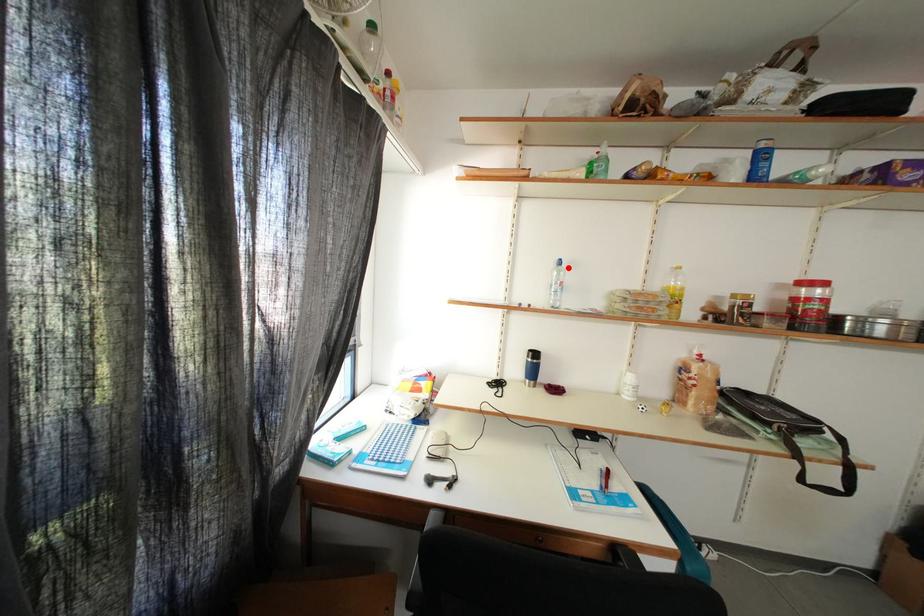
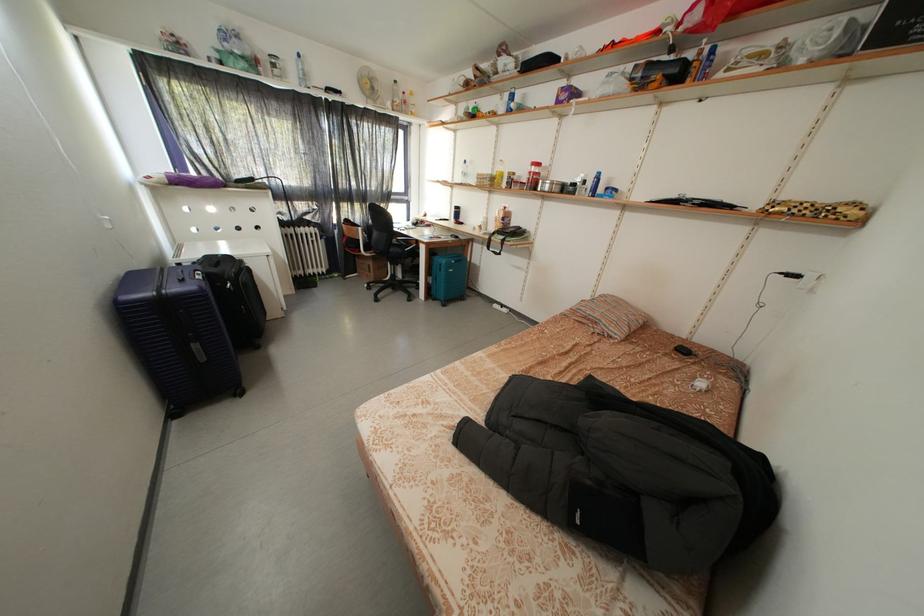
Find the pixel in the second image that matches the highlighted location in the first image.

(472, 167)